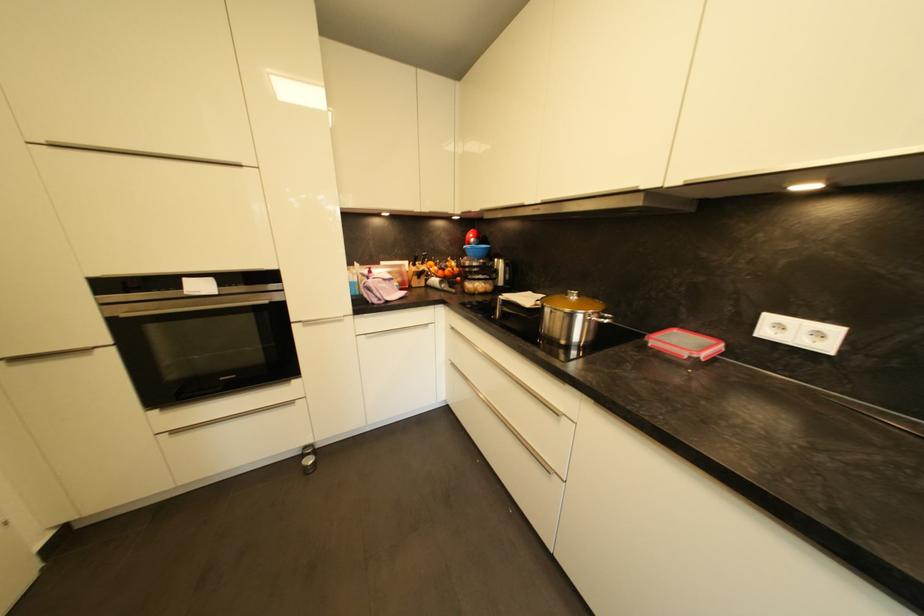
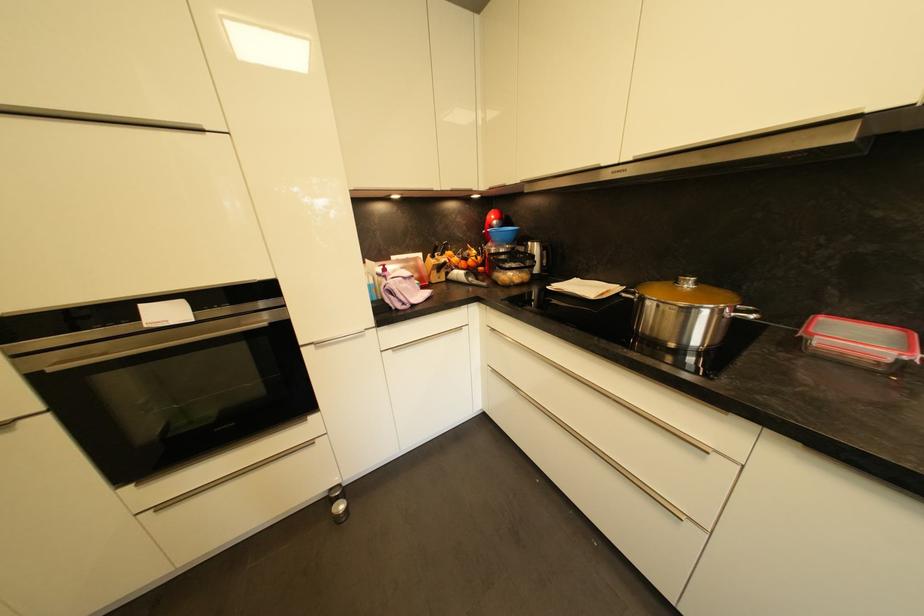
In the second image, find the point that corresponds to (x=578, y=299) in the first image.

(694, 286)